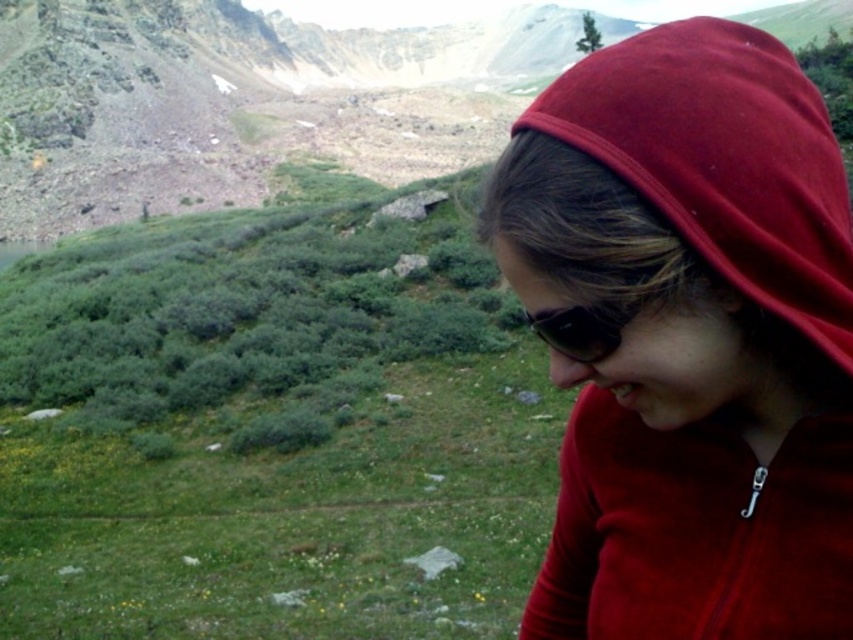
Can you confirm if matte red hoodie at right is wider than black reflective sunglasses at lower right?

Indeed, matte red hoodie at right has a greater width compared to black reflective sunglasses at lower right.

Can you confirm if matte red hoodie at right is bigger than black reflective sunglasses at lower right?

Yes, matte red hoodie at right is bigger than black reflective sunglasses at lower right.

Is point (611, 125) positioned behind point (585, 358)?

That is False.

Image resolution: width=853 pixels, height=640 pixels. I want to click on matte red hoodie at right, so click(689, 337).